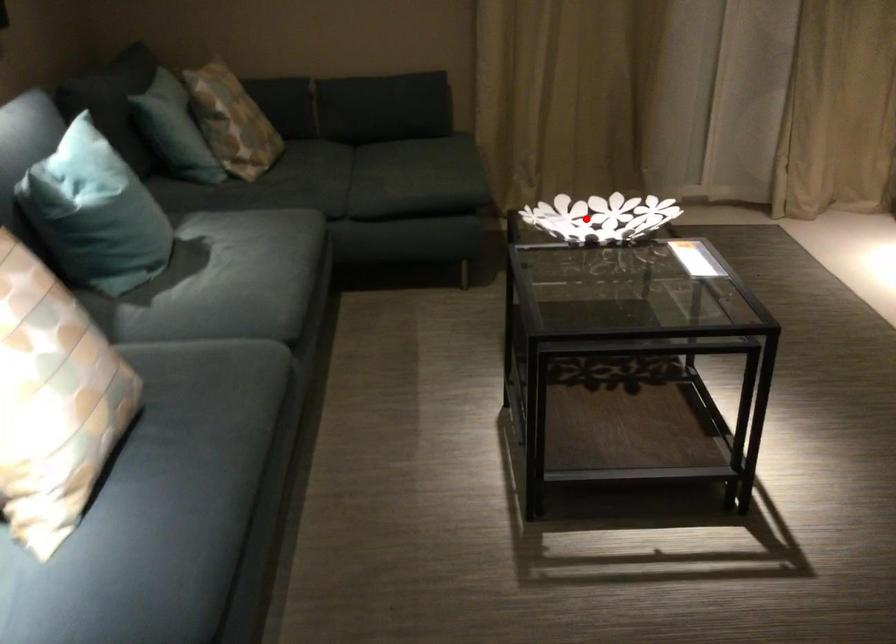
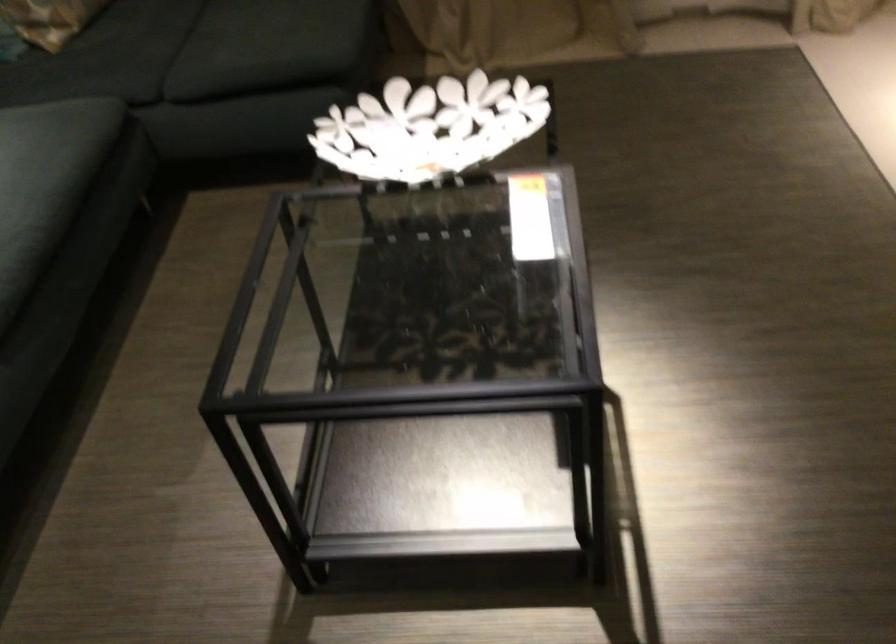
Question: I am providing you with two images of the same scene from different viewpoints. A red point is shown in image1. For the corresponding object point in image2, is it positioned nearer or farther from the camera?

Choices:
 (A) Nearer
 (B) Farther

Answer: (A)